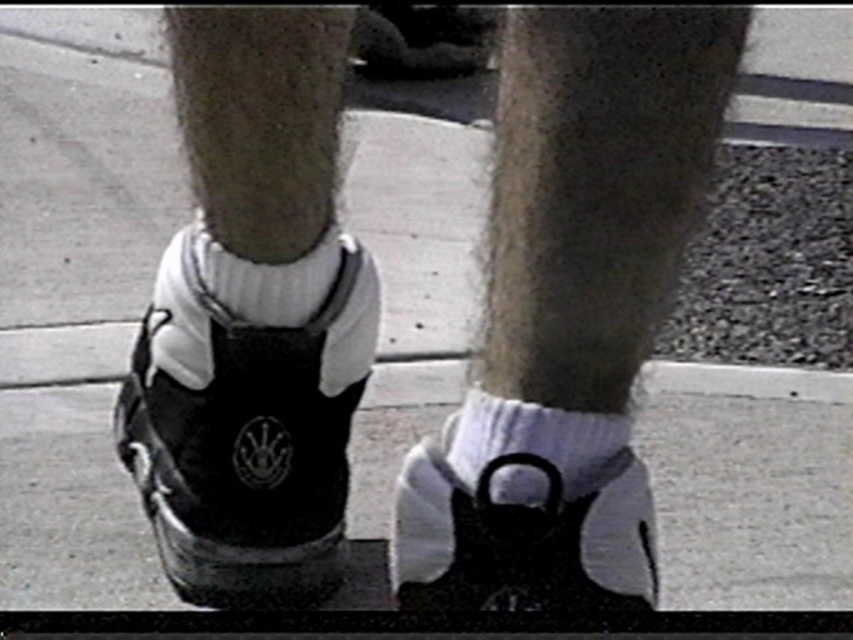
Based on the photo, who is positioned more to the left, black matte shoe at lower center or white soft sock at center?

From the viewer's perspective, black matte shoe at lower center appears more on the left side.

You are a GUI agent. You are given a task and a screenshot of the screen. Output one action in this format:
    pyautogui.click(x=<x>, y=<y>)
    Task: Click on the black matte shoe at lower center
    Image resolution: width=853 pixels, height=640 pixels.
    Given the screenshot: What is the action you would take?
    pyautogui.click(x=521, y=540)

Between point (486, 522) and point (566, 454), which one is positioned in front?

Positioned in front is point (486, 522).

This screenshot has width=853, height=640. Identify the location of black matte shoe at lower center. (521, 540).

Which is above, white matte socks at lower center or white soft sock at center?

Positioned higher is white matte socks at lower center.

Is white matte socks at lower center to the right of white soft sock at center from the viewer's perspective?

Yes, white matte socks at lower center is to the right of white soft sock at center.

Does point (619, 408) lie in front of point (514, 416)?

That is False.

Where is `white matte socks at lower center`? Image resolution: width=853 pixels, height=640 pixels. white matte socks at lower center is located at coordinates (569, 314).

Who is positioned more to the right, black matte sneaker at center or white cotton sock at center?

Positioned to the right is white cotton sock at center.

Which is behind, point (328, 465) or point (273, 268)?

The point (328, 465) is behind.

Is point (172, 524) closer to viewer compared to point (341, 243)?

Yes, point (172, 524) is closer to viewer.

At what (x,y) coordinates should I click in order to perform the action: click on black matte sneaker at center. Please return your answer as a coordinate pair (x, y). Looking at the image, I should click on (248, 445).